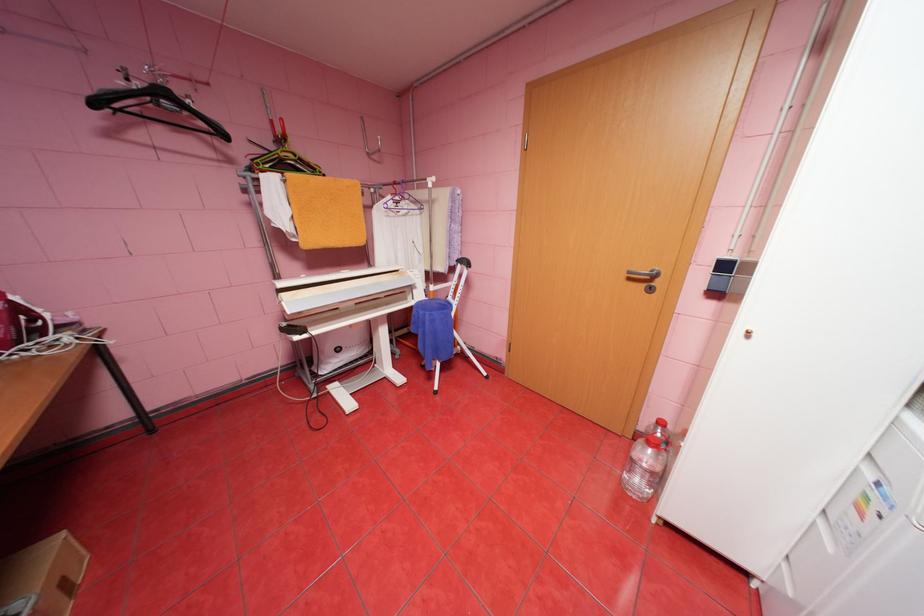
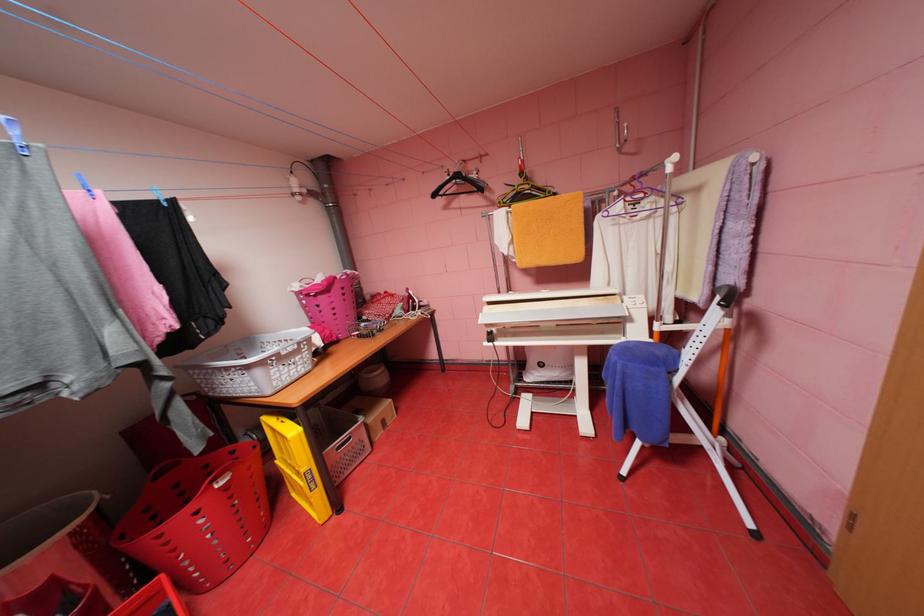
Question: The first image is from the beginning of the video and the second image is from the end. How did the camera likely rotate when shooting the video?

Choices:
 (A) Left
 (B) Right
 (C) Up
 (D) Down

Answer: (A)